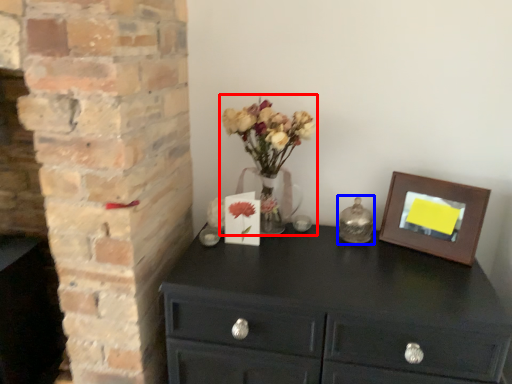
Question: Which object appears farthest to the camera in this image, floral arrangement (highlighted by a red box) or candle holder (highlighted by a blue box)?

Choices:
 (A) floral arrangement
 (B) candle holder

Answer: (B)